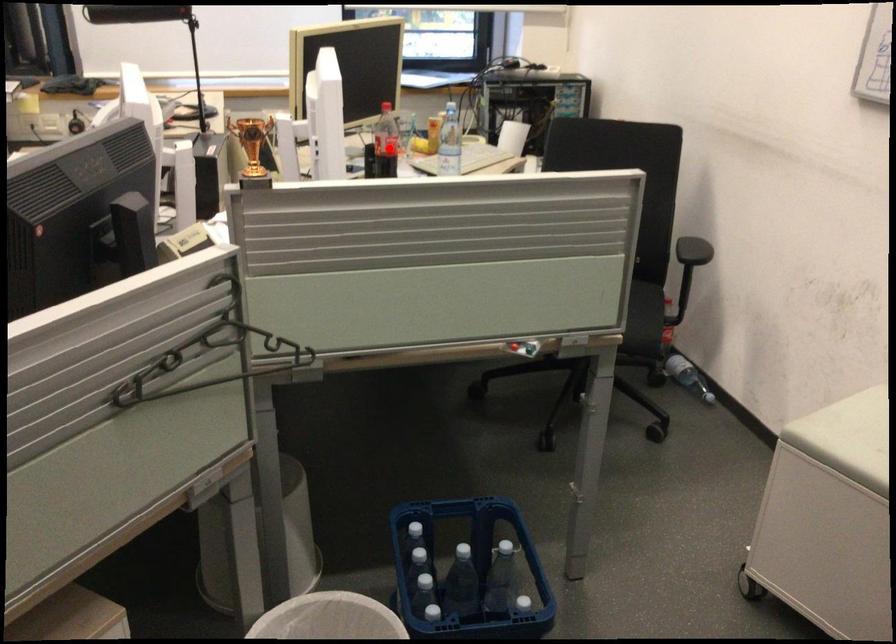
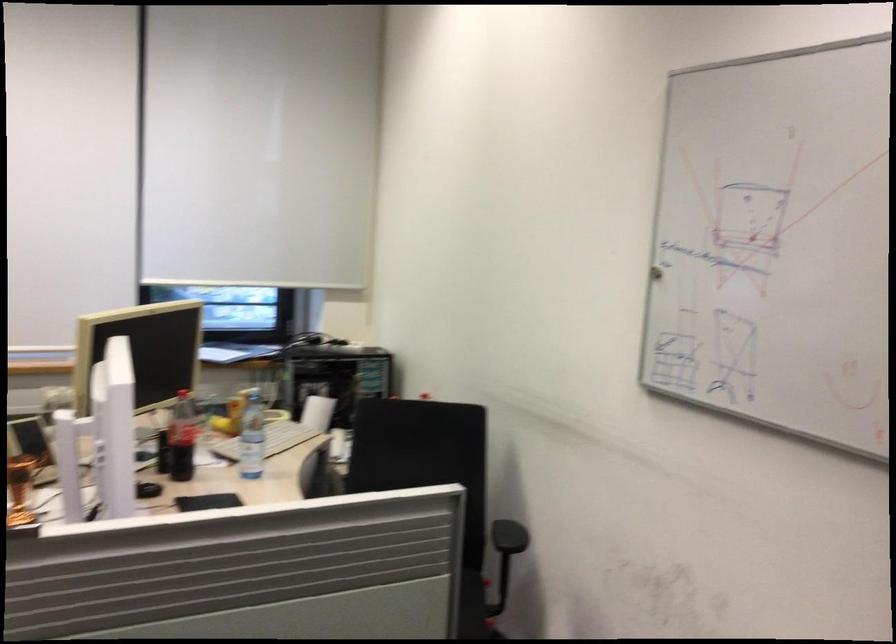
In the second image, find the point that corresponds to the highlighted location in the first image.

(182, 438)